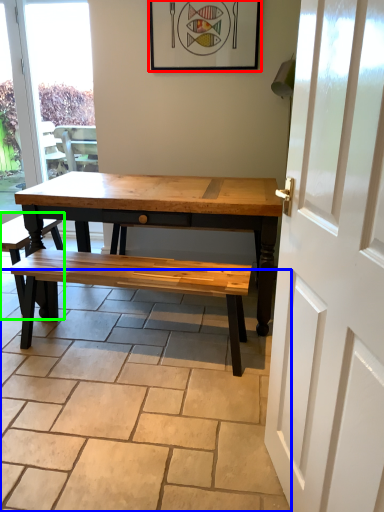
Question: Estimate the real-world distances between objects in this image. Which object is closer to picture frame (highlighted by a red box), path (highlighted by a blue box) or church bench (highlighted by a green box)?

Choices:
 (A) path
 (B) church bench

Answer: (B)